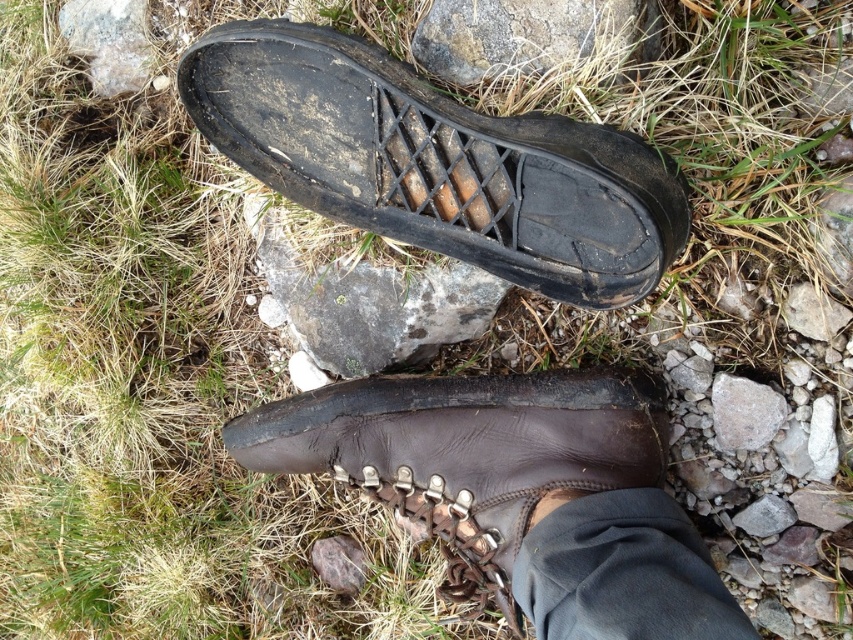
You are a hiker who just found a worn boot on a hiking trail. You see the black rubber shoe at upper center. Where exactly is it located in terms of coordinates?

The black rubber shoe at upper center is located at coordinates point (437, 163).

You are standing 4 feet away from a hiking trail. You see a brown leather boot at center. Can you reach it without moving your feet?

The distance between you and the brown leather boot at center is approximately 3.98 feet, which is just under 4 feet. Since you are standing 4 feet away, you might be able to reach it by stretching your arm, but it might be slightly out of reach depending on your arm length.

You are a hiker who needs to pack your gear. You have a small backpack compartment that can only fit items smaller than the gray rock at upper left. Can the brown leather boot at center fit into this compartment?

The brown leather boot at center has a larger size compared to gray rock at upper left, so it cannot fit into the backpack compartment designed for items smaller than the gray rock at upper left.